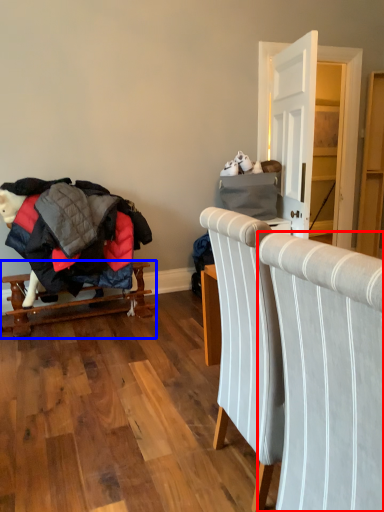
Question: Among these objects, which one is farthest to the camera, chair (highlighted by a red box) or furniture (highlighted by a blue box)?

Choices:
 (A) chair
 (B) furniture

Answer: (B)